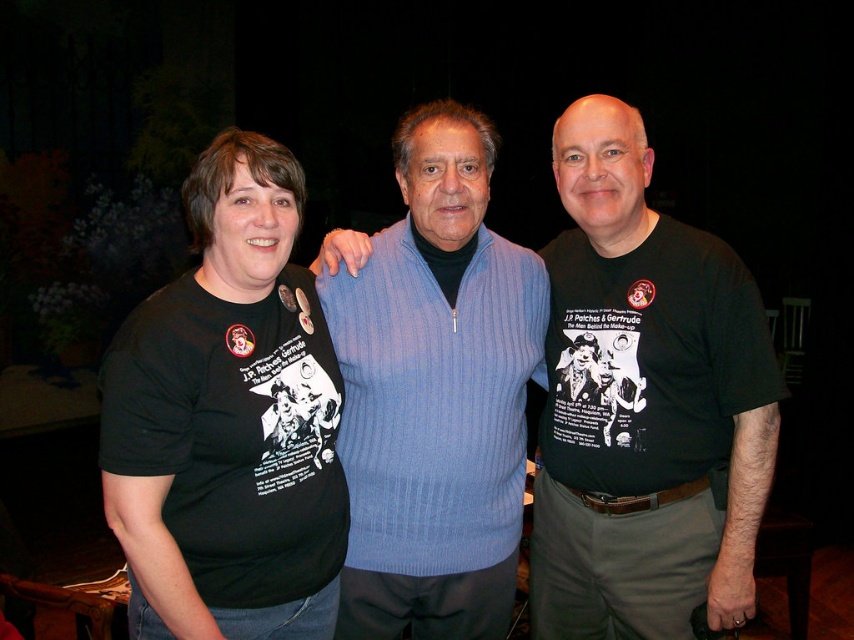
Can you confirm if black t-shirt at center is wider than black cotton t-shirt at left?

Yes.

Can you confirm if black t-shirt at center is bigger than black cotton t-shirt at left?

Yes.

Find the location of a particular element. Image resolution: width=854 pixels, height=640 pixels. black t-shirt at center is located at coordinates (644, 404).

Is point (531, 560) farther from viewer compared to point (566, 426)?

That is True.

Is point (752, 408) in front of point (563, 456)?

Yes, point (752, 408) is in front of point (563, 456).

This screenshot has height=640, width=854. Identify the location of black cotton t-shirt at center. (645, 403).

Does black cotton t-shirt at left appear over light blue ribbed sweater at center?

Incorrect, black cotton t-shirt at left is not positioned above light blue ribbed sweater at center.

Can you confirm if black cotton t-shirt at left is thinner than light blue ribbed sweater at center?

Yes.

Which is in front, point (278, 490) or point (385, 448)?

Point (278, 490)

Locate an element on the screen. black cotton t-shirt at left is located at coordinates (227, 420).